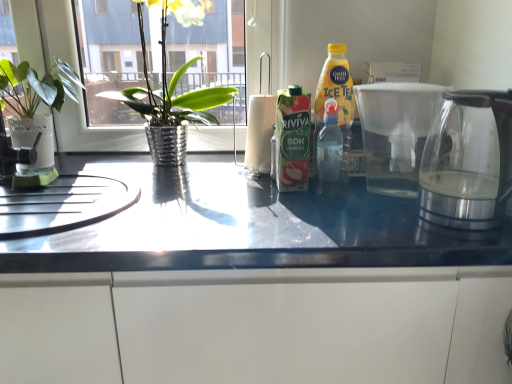
You are a GUI agent. You are given a task and a screenshot of the screen. Output one action in this format:
    pyautogui.click(x=<x>, y=<y>)
    Task: Click on the free space in front of green cardboard carton at center
    The width and height of the screenshot is (512, 384).
    Given the screenshot: What is the action you would take?
    pyautogui.click(x=307, y=218)